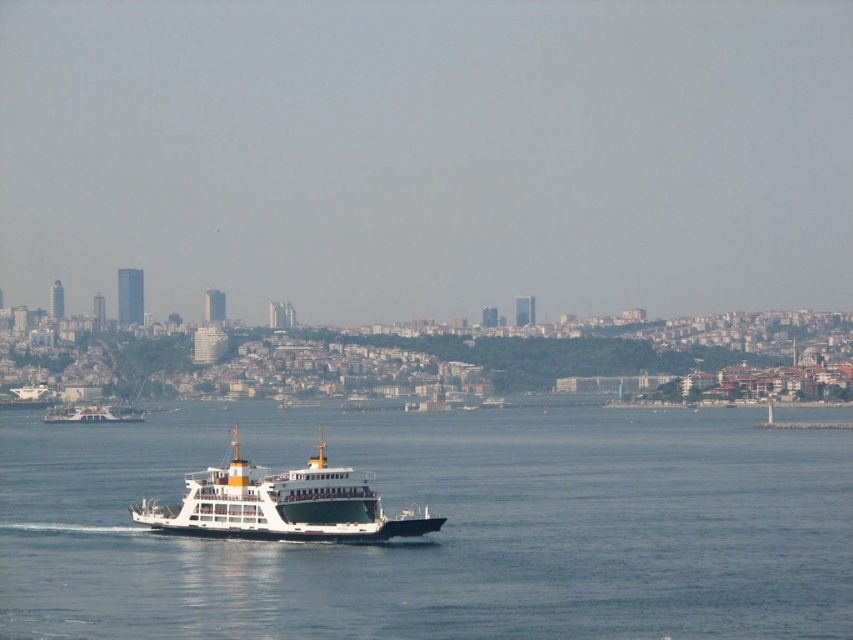
You are standing at point (73, 577) and want to reach the ferry boat. The ferry boat is moving away from you. If the ferry boat is currently 1899.32 feet away from your current position, how far will it be after 10 minutes if it continues moving at the same speed?

The ferry boat is currently 1899.32 feet away from point (73, 577). However, without information about the ferry boat speed, it is impossible to determine the distance after 10 minutes.